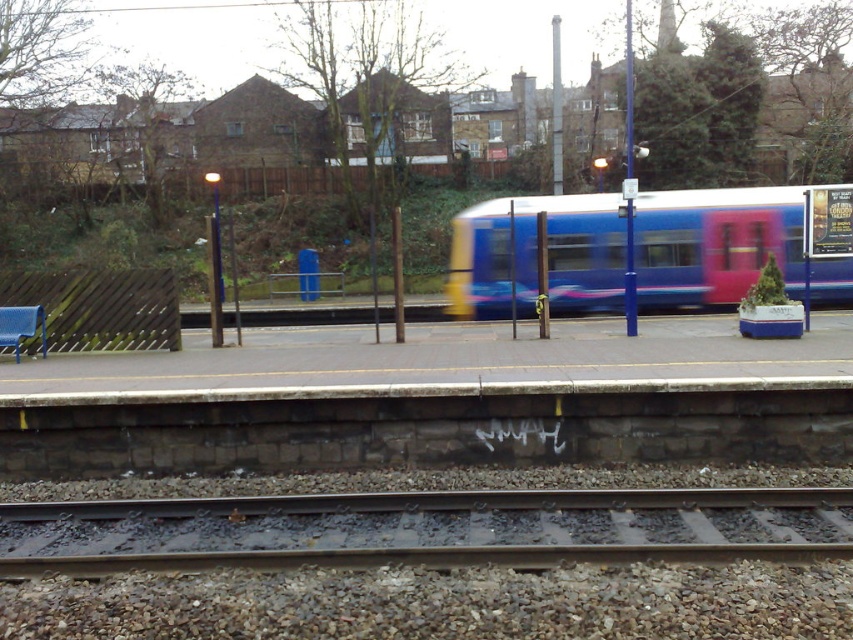
Question: Can you confirm if metal at bottom is wider than blue glossy train at center?

Choices:
 (A) yes
 (B) no

Answer: (B)

Question: Does metal at bottom have a smaller size compared to blue glossy train at center?

Choices:
 (A) yes
 (B) no

Answer: (A)

Question: Is metal at bottom below blue glossy train at center?

Choices:
 (A) no
 (B) yes

Answer: (B)

Question: Which of the following is the farthest from the observer?

Choices:
 (A) metal at bottom
 (B) blue glossy train at center

Answer: (B)

Question: Among these points, which one is nearest to the camera?

Choices:
 (A) (758, 522)
 (B) (689, 209)

Answer: (A)